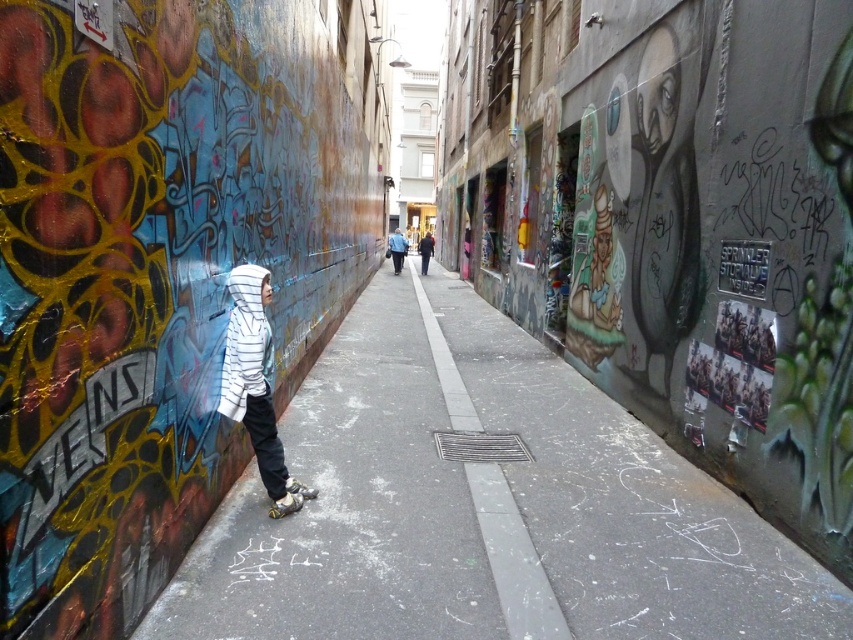
Question: Estimate the real-world distances between objects in this image. Which object is farther from the matte black skateboard at lower center?

Choices:
 (A) smooth asphalt pavement at center
 (B) white striped hoodie at left

Answer: (A)

Question: Is matte black skateboard at lower center below blue denim jacket at center?

Choices:
 (A) no
 (B) yes

Answer: (B)

Question: Considering the relative positions of smooth asphalt pavement at center and blue denim jacket at center in the image provided, where is smooth asphalt pavement at center located with respect to blue denim jacket at center?

Choices:
 (A) right
 (B) left

Answer: (A)

Question: Which object is closer to the camera taking this photo?

Choices:
 (A) blue denim jacket at center
 (B) smooth asphalt pavement at center

Answer: (B)

Question: Estimate the real-world distances between objects in this image. Which object is farther from the smooth asphalt pavement at center?

Choices:
 (A) matte black skateboard at lower center
 (B) white striped hoodie at left

Answer: (B)

Question: Can you confirm if white striped hoodie at left is thinner than matte black skateboard at lower center?

Choices:
 (A) no
 (B) yes

Answer: (A)